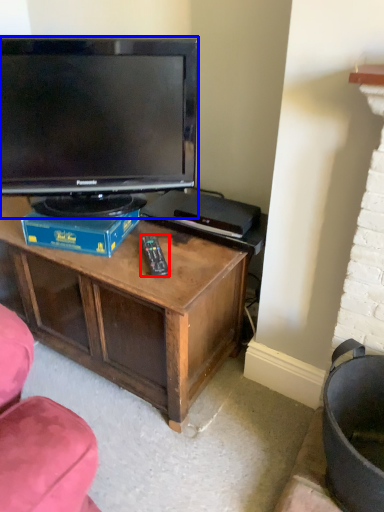
Question: Which object appears closest to the camera in this image, remote (highlighted by a red box) or television (highlighted by a blue box)?

Choices:
 (A) remote
 (B) television

Answer: (B)